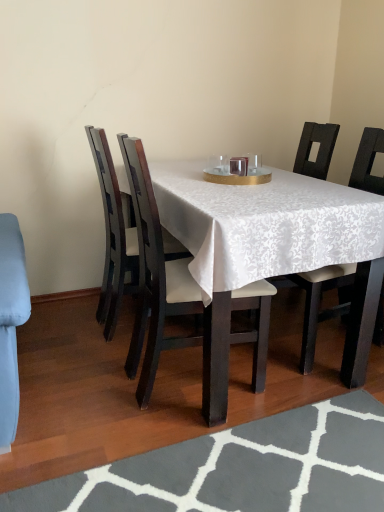
Question: Is white fabric-covered chair at center, which is counted as the 3th chair, starting from the right, closer to the viewer compared to dark wood chair at left, which is counted as the 1th chair, starting from the left?

Choices:
 (A) no
 (B) yes

Answer: (B)

Question: Would you say white fabric-covered chair at center, which is counted as the 3th chair, starting from the right, is outside dark wood chair at left, which is counted as the 1th chair, starting from the left?

Choices:
 (A) no
 (B) yes

Answer: (B)

Question: Is white fabric-covered chair at center, which is counted as the second chair, starting from the left, at the right side of dark wood chair at left, the 4th chair when ordered from right to left?

Choices:
 (A) yes
 (B) no

Answer: (A)

Question: Is white fabric-covered chair at center, which is counted as the 3th chair, starting from the right, far from dark wood chair at left, the 4th chair when ordered from right to left?

Choices:
 (A) yes
 (B) no

Answer: (B)

Question: Is dark wood chair at left, which is counted as the 1th chair, starting from the left, surrounded by white fabric-covered chair at center, which is counted as the 3th chair, starting from the right?

Choices:
 (A) yes
 (B) no

Answer: (B)

Question: Can you confirm if white fabric-covered chair at center, which is counted as the second chair, starting from the left, is bigger than dark wood chair at left, the 4th chair when ordered from right to left?

Choices:
 (A) no
 (B) yes

Answer: (B)

Question: From the image's perspective, is gray textured rug at lower center beneath white fabric chair at center, placed as the 2th chair when sorted from right to left?

Choices:
 (A) no
 (B) yes

Answer: (B)

Question: Is gray textured rug at lower center smaller than white fabric chair at center, placed as the 2th chair when sorted from right to left?

Choices:
 (A) yes
 (B) no

Answer: (A)

Question: Can you confirm if gray textured rug at lower center is positioned to the left of white fabric chair at center, acting as the 3th chair starting from the left?

Choices:
 (A) yes
 (B) no

Answer: (A)

Question: Does gray textured rug at lower center turn towards white fabric chair at center, placed as the 2th chair when sorted from right to left?

Choices:
 (A) no
 (B) yes

Answer: (A)

Question: From the image's perspective, is gray textured rug at lower center located above white fabric chair at center, acting as the 3th chair starting from the left?

Choices:
 (A) no
 (B) yes

Answer: (A)

Question: Is gray textured rug at lower center next to white fabric chair at center, placed as the 2th chair when sorted from right to left, and touching it?

Choices:
 (A) yes
 (B) no

Answer: (B)

Question: From the image's perspective, is white fabric-covered chair at center, which is counted as the 3th chair, starting from the right, under gray textured rug at lower center?

Choices:
 (A) yes
 (B) no

Answer: (B)